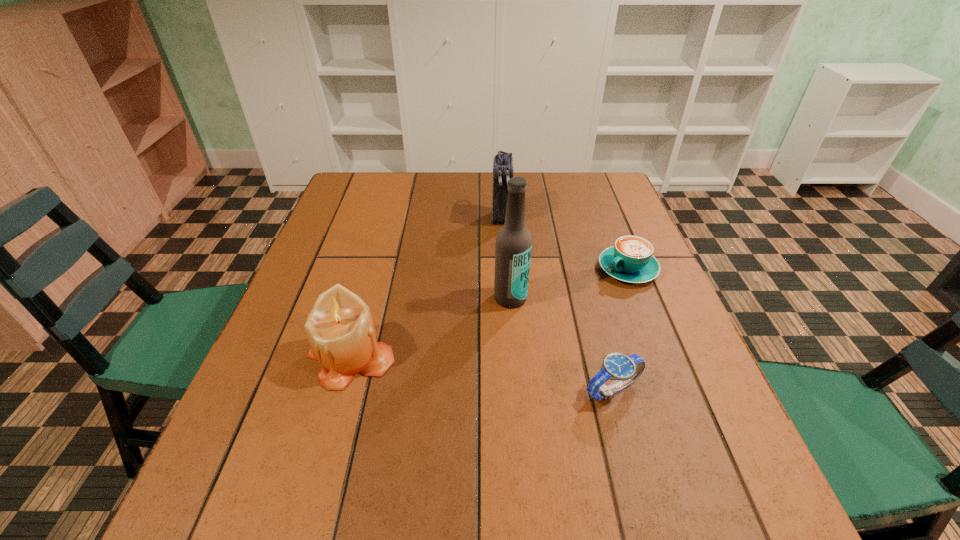
Identify the location of the leftmost object. The height and width of the screenshot is (540, 960). (342, 336).

This screenshot has height=540, width=960. I want to click on candle, so click(342, 336).

I want to click on watch, so click(625, 369).

The height and width of the screenshot is (540, 960). In order to click on clutch bag in this screenshot , I will do `click(503, 164)`.

You are a GUI agent. You are given a task and a screenshot of the screen. Output one action in this format:
    pyautogui.click(x=<x>, y=<y>)
    Task: Click on the beer bottle
    
    Given the screenshot: What is the action you would take?
    pyautogui.click(x=513, y=247)

Where is `cappuccino`? cappuccino is located at coordinates pyautogui.click(x=631, y=259).

The image size is (960, 540). In order to click on free location located 0.150m on the right of the third tallest object in this screenshot , I will do `click(468, 357)`.

The width and height of the screenshot is (960, 540). Find the location of `vacant area situated on the left of the watch`. vacant area situated on the left of the watch is located at coordinates (474, 390).

Where is `free point located 0.090m with the zip open on the farthest object`? Image resolution: width=960 pixels, height=540 pixels. free point located 0.090m with the zip open on the farthest object is located at coordinates (501, 248).

Identify the location of vacant region located with the zip open on the farthest object. (501, 248).